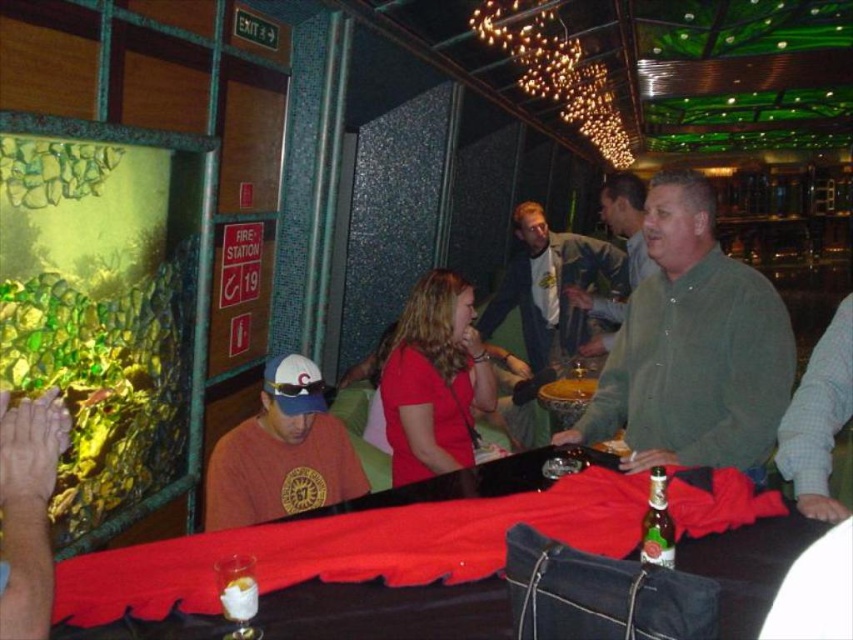
You are a bartender preparing drinks and see the green glass bottle at lower center and the white creamy dessert at center. Which object is taller?

The green glass bottle at lower center is much taller than the white creamy dessert at center.

You are a chef preparing a dessert display. You have a white creamy dessert at center and a smooth wooden bowl at center. Which item should you place on the higher shelf to ensure the display looks balanced?

Since the white creamy dessert at center is smaller than the smooth wooden bowl at center, placing the smooth wooden bowl at center on the lower shelf and the white creamy dessert at center on the higher shelf will create a balanced display.